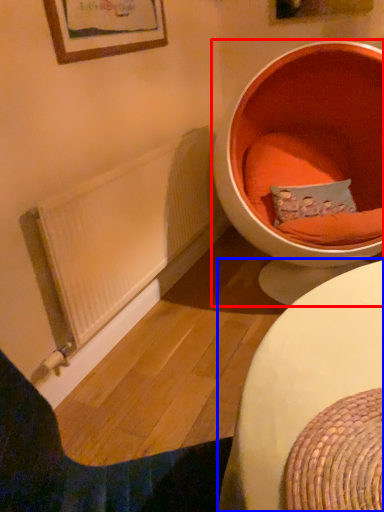
Question: Which object appears farthest to the camera in this image, toilet (highlighted by a red box) or table (highlighted by a blue box)?

Choices:
 (A) toilet
 (B) table

Answer: (A)